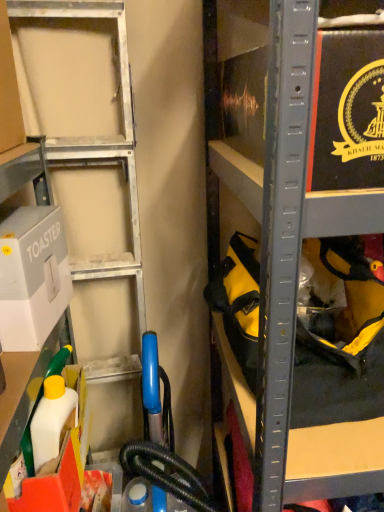
In order to click on white cardboard toaster at left, positioned as the 2th box in bottom-to-top order in this screenshot , I will do `click(32, 276)`.

The image size is (384, 512). What do you see at coordinates (32, 276) in the screenshot?
I see `white cardboard toaster at left, placed as the 1th box when sorted from top to bottom` at bounding box center [32, 276].

The height and width of the screenshot is (512, 384). What do you see at coordinates (61, 464) in the screenshot?
I see `white plastic bottle at lower left, the second box positioned from the top` at bounding box center [61, 464].

Locate an element on the screen. white plastic bottle at lower left, which is counted as the first box, starting from the bottom is located at coordinates (61, 464).

Image resolution: width=384 pixels, height=512 pixels. I want to click on white cardboard toaster at left, positioned as the 2th box in bottom-to-top order, so click(x=32, y=276).

Considering the positions of objects white cardboard toaster at left, placed as the 1th box when sorted from top to bottom, and white plastic bottle at lower left, which is counted as the first box, starting from the bottom, in the image provided, who is more to the left, white cardboard toaster at left, placed as the 1th box when sorted from top to bottom, or white plastic bottle at lower left, which is counted as the first box, starting from the bottom,?

white cardboard toaster at left, placed as the 1th box when sorted from top to bottom.

Relative to white plastic bottle at lower left, the second box positioned from the top, is white cardboard toaster at left, placed as the 1th box when sorted from top to bottom, in front or behind?

white cardboard toaster at left, placed as the 1th box when sorted from top to bottom, is positioned closer to the viewer than white plastic bottle at lower left, the second box positioned from the top.

Is point (42, 251) farther from viewer compared to point (72, 450)?

No, it is in front of (72, 450).

From the image's perspective, would you say white cardboard toaster at left, placed as the 1th box when sorted from top to bottom, is positioned over white plastic bottle at lower left, which is counted as the first box, starting from the bottom?

Correct, white cardboard toaster at left, placed as the 1th box when sorted from top to bottom, appears higher than white plastic bottle at lower left, which is counted as the first box, starting from the bottom, in the image.

From a real-world perspective, is white cardboard toaster at left, placed as the 1th box when sorted from top to bottom, located higher than white plastic bottle at lower left, which is counted as the first box, starting from the bottom?

Yes, from a real-world perspective, white cardboard toaster at left, placed as the 1th box when sorted from top to bottom, is over white plastic bottle at lower left, which is counted as the first box, starting from the bottom

Considering the sizes of objects white cardboard toaster at left, positioned as the 2th box in bottom-to-top order, and white plastic bottle at lower left, the second box positioned from the top, in the image provided, who is thinner, white cardboard toaster at left, positioned as the 2th box in bottom-to-top order, or white plastic bottle at lower left, the second box positioned from the top,?

white cardboard toaster at left, positioned as the 2th box in bottom-to-top order, is thinner.

Does white cardboard toaster at left, placed as the 1th box when sorted from top to bottom, have a lesser height compared to white plastic bottle at lower left, which is counted as the first box, starting from the bottom?

In fact, white cardboard toaster at left, placed as the 1th box when sorted from top to bottom, may be taller than white plastic bottle at lower left, which is counted as the first box, starting from the bottom.

Considering the relative sizes of white cardboard toaster at left, placed as the 1th box when sorted from top to bottom, and white plastic bottle at lower left, the second box positioned from the top, in the image provided, is white cardboard toaster at left, placed as the 1th box when sorted from top to bottom, bigger than white plastic bottle at lower left, the second box positioned from the top,?

Incorrect, white cardboard toaster at left, placed as the 1th box when sorted from top to bottom, is not larger than white plastic bottle at lower left, the second box positioned from the top.

Choose the correct answer: Is white cardboard toaster at left, positioned as the 2th box in bottom-to-top order, inside white plastic bottle at lower left, which is counted as the first box, starting from the bottom, or outside it?

The correct answer is: outside.

Are white cardboard toaster at left, placed as the 1th box when sorted from top to bottom, and white plastic bottle at lower left, which is counted as the first box, starting from the bottom, making contact?

There is a gap between white cardboard toaster at left, placed as the 1th box when sorted from top to bottom, and white plastic bottle at lower left, which is counted as the first box, starting from the bottom.

Is white cardboard toaster at left, positioned as the 2th box in bottom-to-top order, oriented away from white plastic bottle at lower left, the second box positioned from the top?

white cardboard toaster at left, positioned as the 2th box in bottom-to-top order, is not turned away from white plastic bottle at lower left, the second box positioned from the top.

What's the angular difference between white cardboard toaster at left, positioned as the 2th box in bottom-to-top order, and white plastic bottle at lower left, the second box positioned from the top,'s facing directions?

The angular difference between white cardboard toaster at left, positioned as the 2th box in bottom-to-top order, and white plastic bottle at lower left, the second box positioned from the top, is 0.00224 degrees.

Locate an element on the screen. Image resolution: width=384 pixels, height=512 pixels. box below the white cardboard toaster at left, positioned as the 2th box in bottom-to-top order (from a real-world perspective) is located at coordinates (61, 464).

Based on the photo, is white plastic bottle at lower left, the second box positioned from the top, to the left of white cardboard toaster at left, positioned as the 2th box in bottom-to-top order, from the viewer's perspective?

No, white plastic bottle at lower left, the second box positioned from the top, is not to the left of white cardboard toaster at left, positioned as the 2th box in bottom-to-top order.

In the scene shown: Considering the positions of objects white plastic bottle at lower left, the second box positioned from the top, and white cardboard toaster at left, placed as the 1th box when sorted from top to bottom, in the image provided, who is in front, white plastic bottle at lower left, the second box positioned from the top, or white cardboard toaster at left, placed as the 1th box when sorted from top to bottom,?

white cardboard toaster at left, placed as the 1th box when sorted from top to bottom.

Which is in front, point (82, 396) or point (32, 341)?

Point (32, 341)

From the image's perspective, is white plastic bottle at lower left, the second box positioned from the top, above or below white cardboard toaster at left, positioned as the 2th box in bottom-to-top order?

Based on their image positions, white plastic bottle at lower left, the second box positioned from the top, is located beneath white cardboard toaster at left, positioned as the 2th box in bottom-to-top order.

From a real-world perspective, is white plastic bottle at lower left, the second box positioned from the top, on white cardboard toaster at left, placed as the 1th box when sorted from top to bottom?

No, from a real-world perspective, white plastic bottle at lower left, the second box positioned from the top, is not above white cardboard toaster at left, placed as the 1th box when sorted from top to bottom.

Which of these two, white plastic bottle at lower left, which is counted as the first box, starting from the bottom, or white cardboard toaster at left, positioned as the 2th box in bottom-to-top order, is thinner?

With smaller width is white cardboard toaster at left, positioned as the 2th box in bottom-to-top order.

Which of these two, white plastic bottle at lower left, the second box positioned from the top, or white cardboard toaster at left, placed as the 1th box when sorted from top to bottom, stands shorter?

With less height is white plastic bottle at lower left, the second box positioned from the top.

Which of these two, white plastic bottle at lower left, the second box positioned from the top, or white cardboard toaster at left, placed as the 1th box when sorted from top to bottom, is smaller?

white cardboard toaster at left, placed as the 1th box when sorted from top to bottom, is smaller.

Can white cardboard toaster at left, positioned as the 2th box in bottom-to-top order, be found inside white plastic bottle at lower left, the second box positioned from the top?

Actually, white cardboard toaster at left, positioned as the 2th box in bottom-to-top order, is outside white plastic bottle at lower left, the second box positioned from the top.

Are white plastic bottle at lower left, the second box positioned from the top, and white cardboard toaster at left, placed as the 1th box when sorted from top to bottom, far apart?

No, white plastic bottle at lower left, the second box positioned from the top, is not far away from white cardboard toaster at left, placed as the 1th box when sorted from top to bottom.

Does white plastic bottle at lower left, which is counted as the first box, starting from the bottom, turn towards white cardboard toaster at left, placed as the 1th box when sorted from top to bottom?

No, white plastic bottle at lower left, which is counted as the first box, starting from the bottom, is not aimed at white cardboard toaster at left, placed as the 1th box when sorted from top to bottom.

What's the angular difference between white plastic bottle at lower left, the second box positioned from the top, and white cardboard toaster at left, placed as the 1th box when sorted from top to bottom,'s facing directions?

0.00224 degrees.

How much distance is there between white plastic bottle at lower left, which is counted as the first box, starting from the bottom, and white cardboard toaster at left, placed as the 1th box when sorted from top to bottom?

white plastic bottle at lower left, which is counted as the first box, starting from the bottom, and white cardboard toaster at left, placed as the 1th box when sorted from top to bottom, are 10.69 inches apart from each other.

What are the coordinates of `box lying on the right of white cardboard toaster at left, placed as the 1th box when sorted from top to bottom` in the screenshot? It's located at (61, 464).

Find the location of a particular element. The width and height of the screenshot is (384, 512). box above the white plastic bottle at lower left, the second box positioned from the top (from a real-world perspective) is located at coordinates (32, 276).

Identify the location of box below the white cardboard toaster at left, placed as the 1th box when sorted from top to bottom (from the image's perspective). The height and width of the screenshot is (512, 384). tap(61, 464).